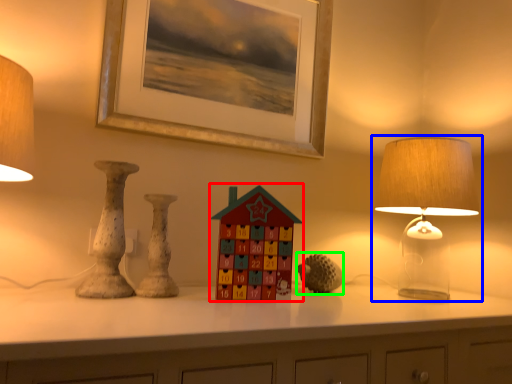
Question: Estimate the real-world distances between objects in this image. Which object is closer to toy (highlighted by a red box), lamp (highlighted by a blue box) or toy (highlighted by a green box)?

Choices:
 (A) lamp
 (B) toy

Answer: (B)